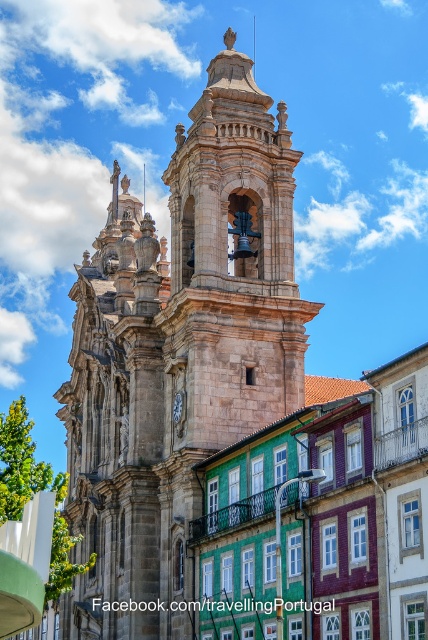
Is brown stone tower at center below white wooden clock at center?

No, brown stone tower at center is not below white wooden clock at center.

Is brown stone tower at center further to camera compared to white wooden clock at center?

No.

I want to click on brown stone tower at center, so click(178, 353).